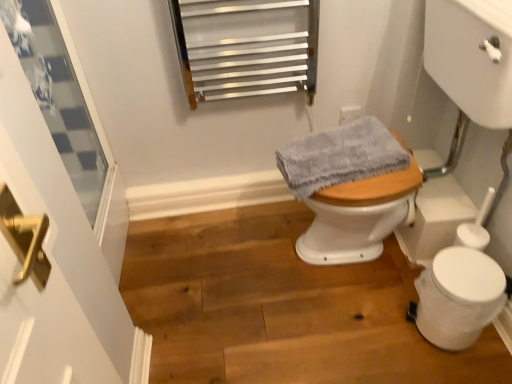
Locate an element on the screen. This screenshot has width=512, height=384. vacant area situated below white glossy sink at right (from a real-world perspective) is located at coordinates (370, 267).